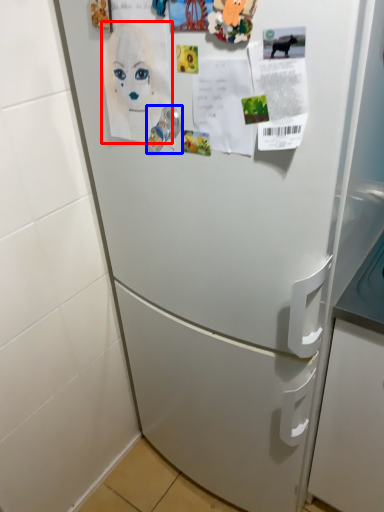
Question: Which object appears closest to the camera in this image, woman (highlighted by a red box) or door handle (highlighted by a blue box)?

Choices:
 (A) woman
 (B) door handle

Answer: (A)